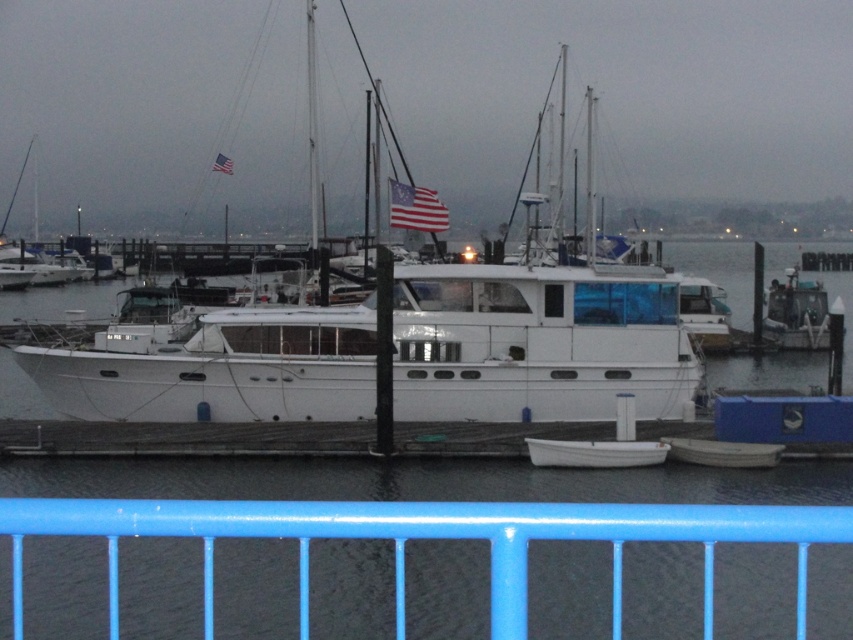
Question: Is white glossy boat at center smaller than blue painted metal railing at lower center?

Choices:
 (A) no
 (B) yes

Answer: (B)

Question: Where is white matte dinghy at lower center located in relation to american flag at center in the image?

Choices:
 (A) left
 (B) right

Answer: (B)

Question: Considering the real-world distances, which object is closest to the american flag at upper center?

Choices:
 (A) white matte boat at lower center
 (B) white matte dinghy at lower center

Answer: (B)

Question: Is white matte boat at lower center below american flag at upper center?

Choices:
 (A) yes
 (B) no

Answer: (A)

Question: Which of the following is the closest to the observer?

Choices:
 (A) white matte boat at lower center
 (B) blue painted metal railing at lower center
 (C) white matte water at center
 (D) american flag at center

Answer: (B)

Question: Which object is positioned farthest from the american flag at upper center?

Choices:
 (A) white matte dinghy at lower center
 (B) white matte boat at lower center

Answer: (B)